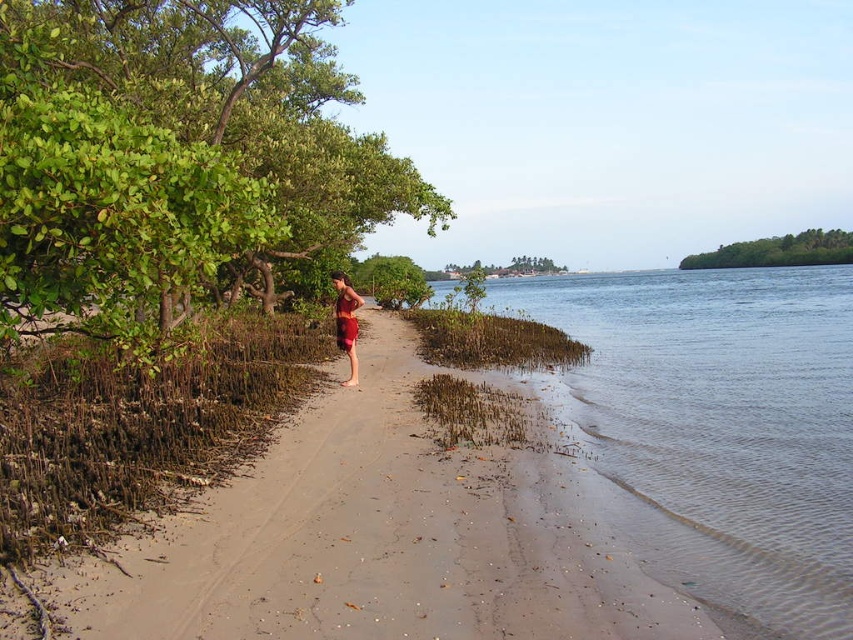
Which of these two, clear water at lower right or matte red skirt at center, stands taller?

With more height is clear water at lower right.

Which is behind, point (534, 372) or point (357, 321)?

The point (534, 372) is more distant.

Which is behind, point (737, 320) or point (347, 310)?

Positioned behind is point (737, 320).

The height and width of the screenshot is (640, 853). In order to click on clear water at lower right in this screenshot , I will do `click(715, 428)`.

Is point (144, 326) more distant than point (467, 515)?

Yes.

Where is `green leafy tree at left`? The height and width of the screenshot is (640, 853). green leafy tree at left is located at coordinates (178, 160).

Who is positioned more to the right, matte red skirt at center or green leafy tree at center?

green leafy tree at center

Is matte red skirt at center further to the viewer compared to green leafy tree at center?

No, matte red skirt at center is in front of green leafy tree at center.

Where is `matte red skirt at center`? The width and height of the screenshot is (853, 640). matte red skirt at center is located at coordinates (346, 323).

At what (x,y) coordinates should I click in order to perform the action: click on matte red skirt at center. Please return your answer as a coordinate pair (x, y). Looking at the image, I should click on (346, 323).